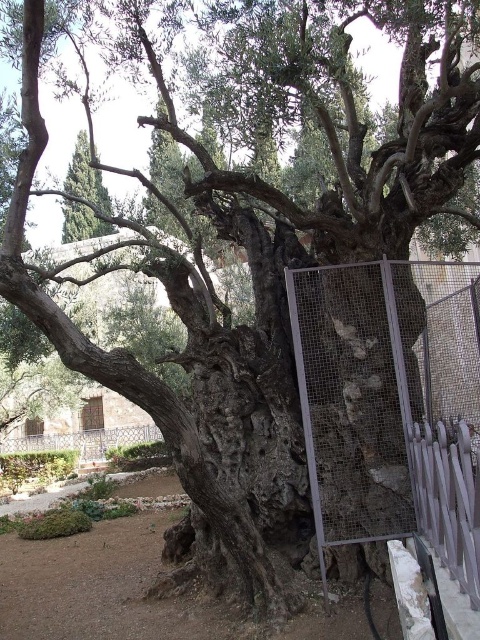
Which is more to the right, white metal fence at right or green rough textured tree at upper left?

Positioned to the right is white metal fence at right.

Is point (462, 477) positioned behind point (87, 198)?

No, it is in front of (87, 198).

Find the location of a particular element. white metal fence at right is located at coordinates (447, 497).

Find the location of `white metal fence at right`. white metal fence at right is located at coordinates (447, 497).

Is green rough textured tree at upper left bigger than wrought iron fence at lower left?

Correct, green rough textured tree at upper left is larger in size than wrought iron fence at lower left.

Can you confirm if green rough textured tree at upper left is positioned below wrought iron fence at lower left?

No.

Measure the distance between point (78, 163) and camera.

45.23 feet

Image resolution: width=480 pixels, height=640 pixels. I want to click on green rough textured tree at upper left, so click(x=85, y=177).

Which is in front, point (436, 513) or point (96, 436)?

Point (436, 513)

Can you confirm if white metal fence at right is taller than wrought iron fence at lower left?

No.

Is point (470, 472) less distant than point (112, 428)?

That is True.

This screenshot has width=480, height=640. I want to click on white metal fence at right, so click(x=447, y=497).